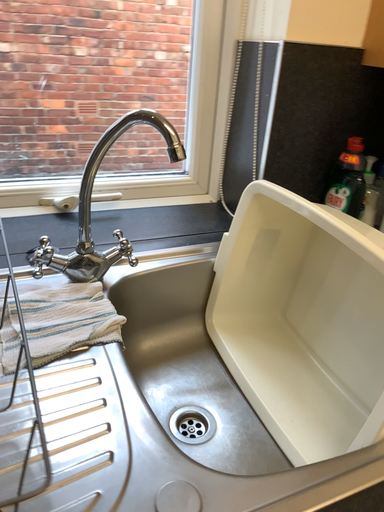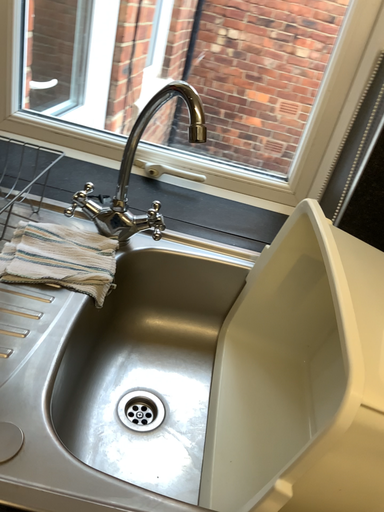
Question: How did the camera likely rotate when shooting the video?

Choices:
 (A) rotated right
 (B) rotated left

Answer: (B)